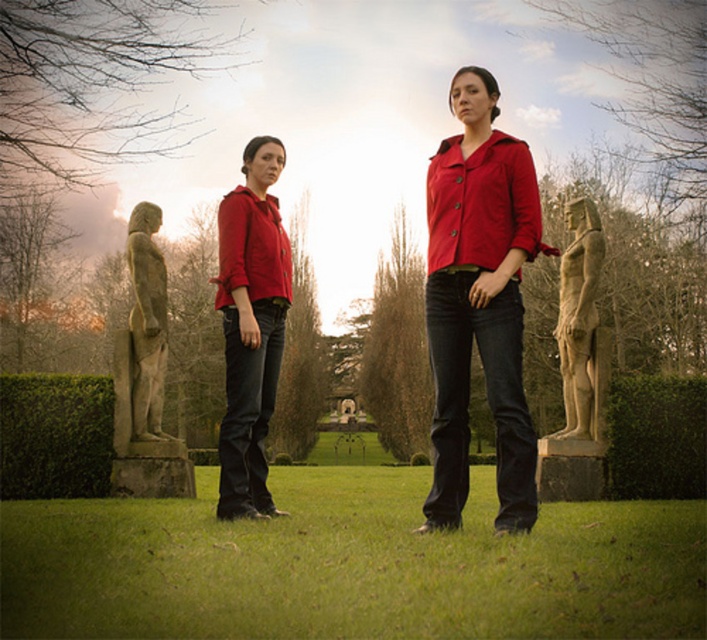
Question: Based on their relative distances, which object is nearer to the stone statue at left?

Choices:
 (A) stone statue at right
 (B) matte red shirt at center

Answer: (B)

Question: Which object is the closest to the stone statue at right?

Choices:
 (A) stone statue at left
 (B) matte red jacket at center

Answer: (B)

Question: Can you confirm if matte red jacket at center is wider than matte red shirt at center?

Choices:
 (A) no
 (B) yes

Answer: (B)

Question: Where is matte red shirt at center located in relation to stone statue at right in the image?

Choices:
 (A) above
 (B) below

Answer: (B)

Question: Estimate the real-world distances between objects in this image. Which object is farther from the matte red shirt at center?

Choices:
 (A) stone statue at left
 (B) stone statue at right
 (C) matte red jacket at center

Answer: (B)

Question: Is matte red jacket at center to the left of matte red shirt at center from the viewer's perspective?

Choices:
 (A) no
 (B) yes

Answer: (A)